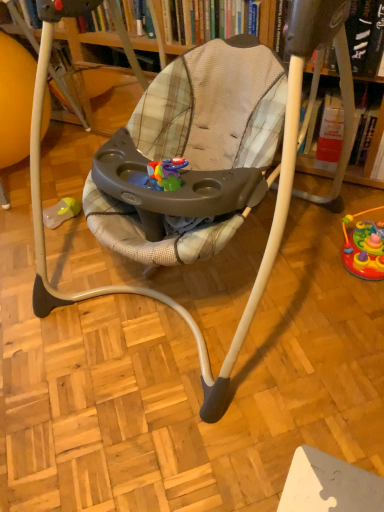
Find the location of a particular element. The image size is (384, 512). hardcover book at upper center, which is the 1th book from left to right is located at coordinates (205, 20).

In order to face rubberized plastic toy at lower right, should I rotate leftwards or rightwards?

Rotate your view right by about 22.605°.

Locate an element on the screen. plaid fabric baby swing at center is located at coordinates coord(186,169).

Is hardcover book at upper center, which is the 1th book from left to right, facing towards hardcover book at upper center, the first book viewed from the right?

No.

Consider the image. Is hardcover book at upper center, which is the 1th book from left to right, thinner than hardcover book at upper center, the first book viewed from the right?

Yes.

From a real-world perspective, is hardcover book at upper center, which is the 1th book from left to right, located beneath hardcover book at upper center, the 2th book positioned from the left?

Yes, from a real-world perspective, hardcover book at upper center, which is the 1th book from left to right, is under hardcover book at upper center, the 2th book positioned from the left.

In the image, is hardcover book at upper center, the 2th book from the right, on the left side or the right side of hardcover book at upper center, the first book viewed from the right?

hardcover book at upper center, the 2th book from the right, is positioned on hardcover book at upper center, the first book viewed from the right,'s left side.

Which of these two, hardcover book at upper center, the first book viewed from the right, or rubberized plastic toy at lower right, is bigger?

With larger size is hardcover book at upper center, the first book viewed from the right.

What's the angular difference between hardcover book at upper center, the first book viewed from the right, and rubberized plastic toy at lower right's facing directions?

0.0505 degrees separate the facing orientations of hardcover book at upper center, the first book viewed from the right, and rubberized plastic toy at lower right.

From the image's perspective, which is below, hardcover book at upper center, the 2th book positioned from the left, or rubberized plastic toy at lower right?

From the image's view, rubberized plastic toy at lower right is below.

Does point (351, 22) lie in front of point (350, 218)?

Yes, point (351, 22) is closer to viewer.

Between plaid fabric baby swing at center and hardcover book at upper center, the 2th book positioned from the left, which one has more height?

With more height is plaid fabric baby swing at center.

Is plaid fabric baby swing at center positioned with its back to hardcover book at upper center, the 2th book positioned from the left?

That's right, plaid fabric baby swing at center is facing away from hardcover book at upper center, the 2th book positioned from the left.

Measure the distance between plaid fabric baby swing at center and hardcover book at upper center, the 2th book positioned from the left.

plaid fabric baby swing at center is 23.38 inches from hardcover book at upper center, the 2th book positioned from the left.

Looking at the image, does plaid fabric baby swing at center seem bigger or smaller compared to hardcover book at upper center, the first book viewed from the right?

Considering their sizes, plaid fabric baby swing at center takes up more space than hardcover book at upper center, the first book viewed from the right.

Is rubberized plastic toy at lower right taller than hardcover book at upper center, the 2th book positioned from the left?

No, rubberized plastic toy at lower right is not taller than hardcover book at upper center, the 2th book positioned from the left.

Are rubberized plastic toy at lower right and hardcover book at upper center, the first book viewed from the right, making contact?

No, rubberized plastic toy at lower right is not beside hardcover book at upper center, the first book viewed from the right.

Considering their positions, is rubberized plastic toy at lower right located in front of or behind hardcover book at upper center, the first book viewed from the right?

In the image, rubberized plastic toy at lower right appears behind hardcover book at upper center, the first book viewed from the right.

Looking at this image, considering the relative positions of rubberized plastic toy at lower right and hardcover book at upper center, the 2th book positioned from the left, in the image provided, is rubberized plastic toy at lower right to the right of hardcover book at upper center, the 2th book positioned from the left, from the viewer's perspective?

Yes.

Considering the relative sizes of rubberized plastic toy at lower right and plaid fabric baby swing at center in the image provided, is rubberized plastic toy at lower right wider than plaid fabric baby swing at center?

Incorrect, the width of rubberized plastic toy at lower right does not surpass that of plaid fabric baby swing at center.

In terms of height, does rubberized plastic toy at lower right look taller or shorter compared to plaid fabric baby swing at center?

In the image, rubberized plastic toy at lower right appears to be shorter than plaid fabric baby swing at center.

Does point (354, 239) appear closer or farther from the camera than point (244, 87)?

Point (354, 239) is positioned farther from the camera compared to point (244, 87).

From a real-world perspective, relative to plaid fabric baby swing at center, is rubberized plastic toy at lower right vertically above or below?

In terms of real-world spatial position, rubberized plastic toy at lower right is below plaid fabric baby swing at center.

Is plaid fabric baby swing at center at the right side of hardcover book at upper center, which is the 1th book from left to right?

In fact, plaid fabric baby swing at center is to the left of hardcover book at upper center, which is the 1th book from left to right.

Between plaid fabric baby swing at center and hardcover book at upper center, the 2th book from the right, which one is positioned behind?

hardcover book at upper center, the 2th book from the right, is further away from the camera.

Considering the relative sizes of plaid fabric baby swing at center and hardcover book at upper center, which is the 1th book from left to right, in the image provided, is plaid fabric baby swing at center wider than hardcover book at upper center, which is the 1th book from left to right,?

Yes.

Are hardcover book at upper center, the first book viewed from the right, and plaid fabric baby swing at center beside each other?

hardcover book at upper center, the first book viewed from the right, and plaid fabric baby swing at center are clearly separated.

Is hardcover book at upper center, the first book viewed from the right, positioned with its back to plaid fabric baby swing at center?

No, hardcover book at upper center, the first book viewed from the right, is not facing away from plaid fabric baby swing at center.

Does hardcover book at upper center, the first book viewed from the right, have a greater height compared to plaid fabric baby swing at center?

Incorrect, the height of hardcover book at upper center, the first book viewed from the right, is not larger of that of plaid fabric baby swing at center.

How much distance is there between hardcover book at upper center, the first book viewed from the right, and plaid fabric baby swing at center?

The distance of hardcover book at upper center, the first book viewed from the right, from plaid fabric baby swing at center is 23.38 inches.

Image resolution: width=384 pixels, height=512 pixels. In order to click on book on the right of hardcover book at upper center, which is the 1th book from left to right in this screenshot , I will do `click(365, 35)`.

I want to click on book that appears in front of the rubberized plastic toy at lower right, so click(x=365, y=35).

When comparing their distances from plaid fabric baby swing at center, does hardcover book at upper center, the first book viewed from the right, or rubberized plastic toy at lower right seem closer?

Among the two, hardcover book at upper center, the first book viewed from the right, is located nearer to plaid fabric baby swing at center.

Looking at the image, which one is located further to hardcover book at upper center, the first book viewed from the right, plaid fabric baby swing at center or rubberized plastic toy at lower right?

Answer: plaid fabric baby swing at center.

Looking at the image, which one is located closer to hardcover book at upper center, which is the 1th book from left to right, hardcover book at upper center, the 2th book positioned from the left, or plaid fabric baby swing at center?

hardcover book at upper center, the 2th book positioned from the left, is closer to hardcover book at upper center, which is the 1th book from left to right.

From the image, which object appears to be nearer to rubberized plastic toy at lower right, plaid fabric baby swing at center or hardcover book at upper center, the 2th book positioned from the left?

hardcover book at upper center, the 2th book positioned from the left, is closer to rubberized plastic toy at lower right.

When comparing their distances from hardcover book at upper center, the first book viewed from the right, does hardcover book at upper center, the 2th book from the right, or plaid fabric baby swing at center seem closer?

The object closer to hardcover book at upper center, the first book viewed from the right, is hardcover book at upper center, the 2th book from the right.

Based on their spatial positions, is hardcover book at upper center, the 2th book positioned from the left, or hardcover book at upper center, which is the 1th book from left to right, closer to rubberized plastic toy at lower right?

hardcover book at upper center, the 2th book positioned from the left, lies closer to rubberized plastic toy at lower right than the other object.

Looking at the image, which one is located further to rubberized plastic toy at lower right, hardcover book at upper center, which is the 1th book from left to right, or hardcover book at upper center, the 2th book positioned from the left?

hardcover book at upper center, which is the 1th book from left to right, is positioned further to the anchor rubberized plastic toy at lower right.

Which object lies nearer to the anchor point hardcover book at upper center, the 2th book positioned from the left, hardcover book at upper center, which is the 1th book from left to right, or rubberized plastic toy at lower right?

Based on the image, hardcover book at upper center, which is the 1th book from left to right, appears to be nearer to hardcover book at upper center, the 2th book positioned from the left.

What are the coordinates of `book that lies between hardcover book at upper center, which is the 1th book from left to right, and rubberized plastic toy at lower right from top to bottom` in the screenshot? It's located at (365, 35).

I want to click on book positioned between plaid fabric baby swing at center and hardcover book at upper center, which is the 1th book from left to right, from near to far, so click(x=365, y=35).

Identify the location of toy between plaid fabric baby swing at center and hardcover book at upper center, which is the 1th book from left to right, along the z-axis. This screenshot has height=512, width=384. (364, 247).

At what (x,y) coordinates should I click in order to perform the action: click on book located between plaid fabric baby swing at center and rubberized plastic toy at lower right in the depth direction. Please return your answer as a coordinate pair (x, y). This screenshot has height=512, width=384. Looking at the image, I should click on (365, 35).